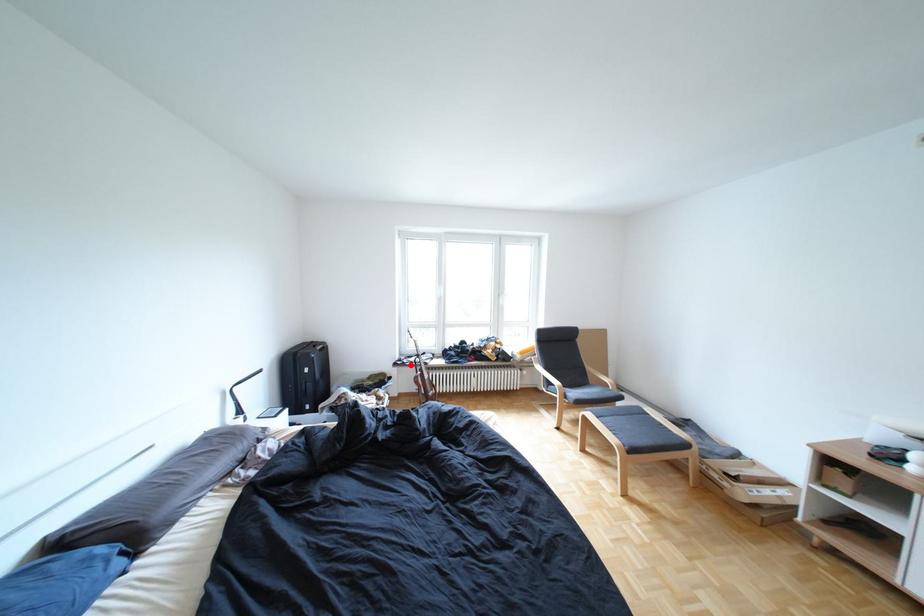
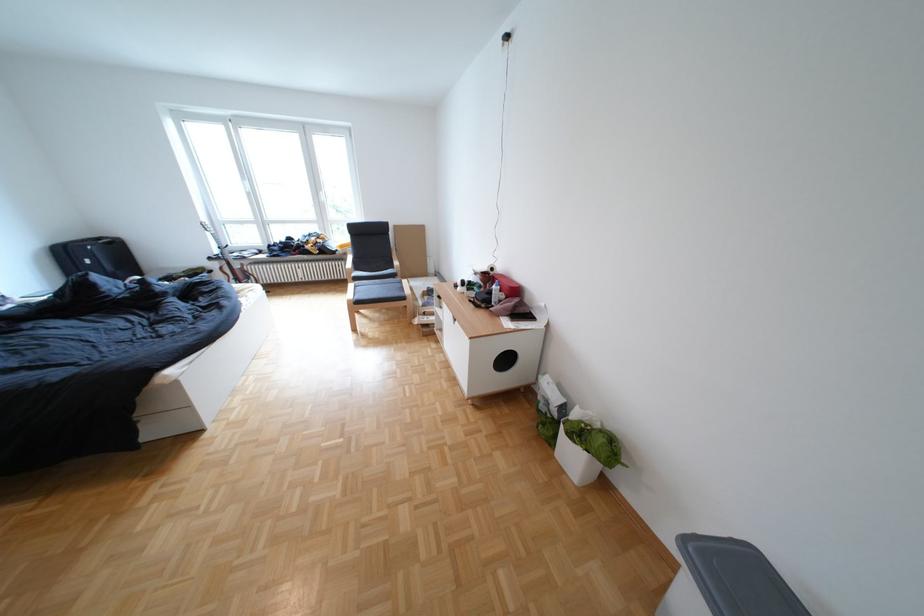
Question: A red point is marked in image1. In image2, is the corresponding 3D point closer to the camera or farther? Reply with the corresponding letter.

Choices:
 (A) The corresponding 3D point is closer.
 (B) The corresponding 3D point is farther.

Answer: (A)